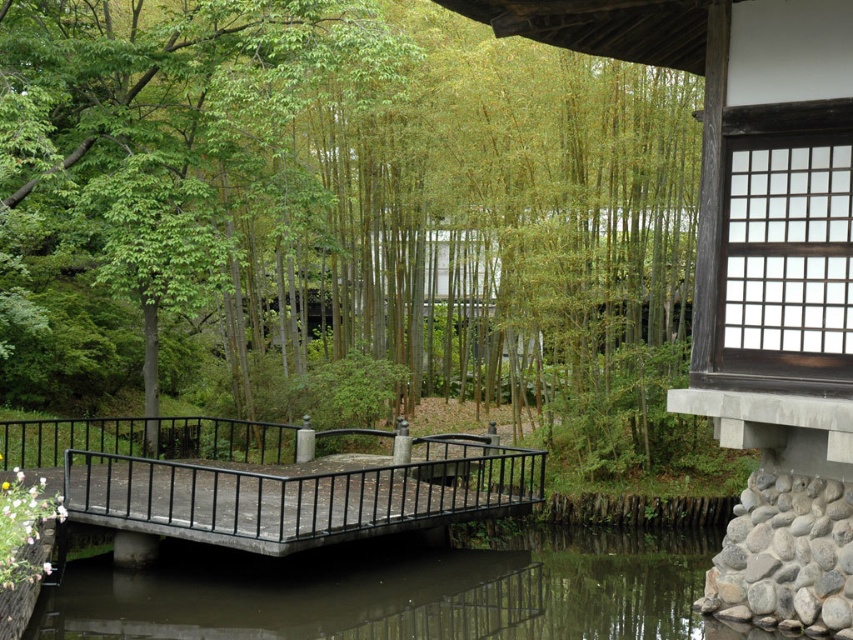
You are a visitor at the garden and want to cross the rustic wood bridge at center to the other side. Can you step onto the clear water at bridge center without getting wet?

The clear water at bridge center has a lesser height compared to rustic wood bridge at center, so stepping onto the clear water at bridge center would mean stepping into the water, which would get you wet. To cross safely, you should stay on the rustic wood bridge at center.

You are standing at the point labeled as point (636,148) in the image. You want to walk to the curved bridge. Is the curved bridge located to your left or right side?

The curved bridge is located to your right side because the distance between point (636,148) and the curved bridge is 14.83 meters, but without additional directional information, we cannot determine the direction based solely on distance.

You are a visitor in the garden and want to take a photo of the clear water at bridge center. To do this, you need to position yourself so that the green bamboo at center is visible to the left of the water in your photo. Is this possible given their positions?

Yes, since the green bamboo at center is to the left of clear water at bridge center, positioning yourself so that the green bamboo is on the left side of the frame with the water at the center will capture them in the desired arrangement.